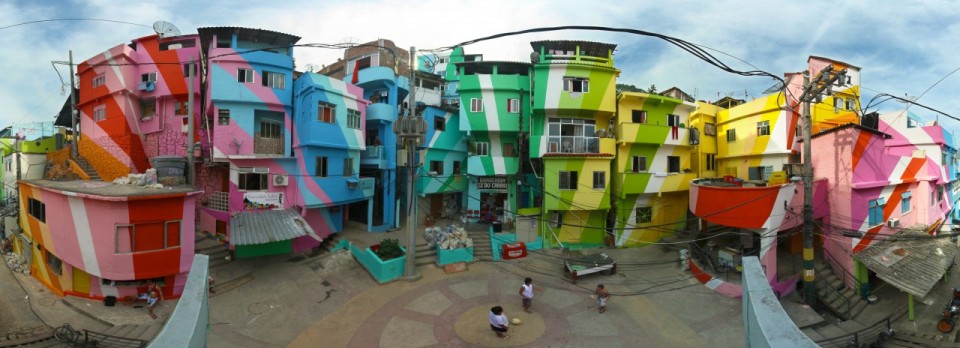
Locate an element on the screen. The image size is (960, 348). wires is located at coordinates (796, 72).